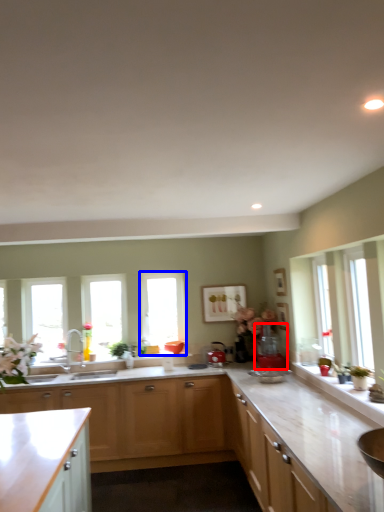
Question: Which of the following is the farthest to the observer, appliance (highlighted by a red box) or window (highlighted by a blue box)?

Choices:
 (A) appliance
 (B) window

Answer: (B)